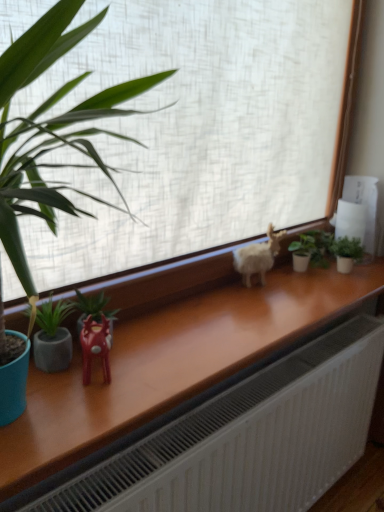
Question: Is white matte window at center positioned before green matte plant at left, marked as the 1th houseplant in a front-to-back arrangement?

Choices:
 (A) yes
 (B) no

Answer: (A)

Question: Is white matte window at center thinner than green matte plant at left, placed as the 4th houseplant when sorted from back to front?

Choices:
 (A) yes
 (B) no

Answer: (B)

Question: From the image's perspective, does white matte window at center appear higher than green matte plant at left, placed as the 4th houseplant when sorted from back to front?

Choices:
 (A) yes
 (B) no

Answer: (A)

Question: Considering the relative sizes of white matte window at center and green matte plant at left, which is counted as the 1th houseplant, starting from the left, in the image provided, is white matte window at center wider than green matte plant at left, which is counted as the 1th houseplant, starting from the left,?

Choices:
 (A) no
 (B) yes

Answer: (B)

Question: Is white matte window at center far from green matte plant at left, placed as the 4th houseplant when sorted from back to front?

Choices:
 (A) no
 (B) yes

Answer: (A)

Question: Considering the relative sizes of white matte window at center and green matte plant at left, placed as the 4th houseplant when sorted from back to front, in the image provided, is white matte window at center taller than green matte plant at left, placed as the 4th houseplant when sorted from back to front,?

Choices:
 (A) yes
 (B) no

Answer: (A)

Question: From a real-world perspective, is green matte plant at center-right, positioned as the 4th houseplant in front-to-back order, under shiny red plastic reindeer at center-left?

Choices:
 (A) no
 (B) yes

Answer: (B)

Question: Is green matte plant at center-right, which is the 2th houseplant from right to left, to the left of shiny red plastic reindeer at center-left from the viewer's perspective?

Choices:
 (A) yes
 (B) no

Answer: (B)

Question: Is green matte plant at center-right, positioned as the 4th houseplant in front-to-back order, outside shiny red plastic reindeer at center-left?

Choices:
 (A) no
 (B) yes

Answer: (B)

Question: Is green matte plant at center-right, positioned as the 4th houseplant in front-to-back order, further to camera compared to shiny red plastic reindeer at center-left?

Choices:
 (A) yes
 (B) no

Answer: (A)

Question: Can you confirm if green matte plant at center-right, the first houseplant positioned from the back, is positioned to the right of shiny red plastic reindeer at center-left?

Choices:
 (A) yes
 (B) no

Answer: (A)

Question: Is green matte plant at center-right, positioned as the 4th houseplant in front-to-back order, oriented away from shiny red plastic reindeer at center-left?

Choices:
 (A) no
 (B) yes

Answer: (A)

Question: Can you confirm if green matte plant at right, acting as the second houseplant starting from the back, is taller than white fluffy goat at center?

Choices:
 (A) no
 (B) yes

Answer: (A)